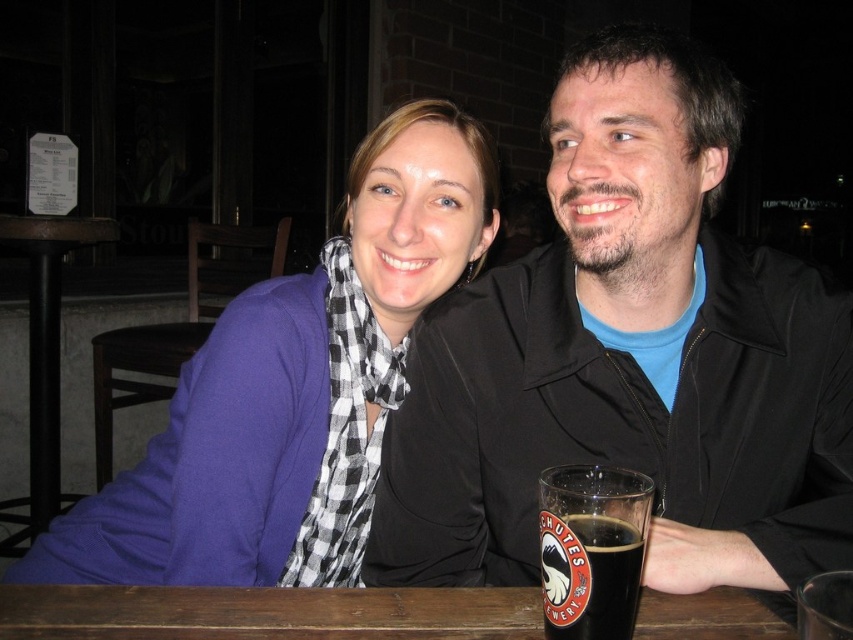
Question: Among these objects, which one is nearest to the camera?

Choices:
 (A) brown wooden table at lower left
 (B) black matte jacket at upper right

Answer: (B)

Question: Which point is farther from the camera taking this photo?

Choices:
 (A) (474, 205)
 (B) (30, 486)
 (C) (573, 621)

Answer: (B)

Question: Can you confirm if black matte jacket at upper right is thinner than brown wooden table at lower center?

Choices:
 (A) yes
 (B) no

Answer: (A)

Question: Can you confirm if purple soft fabric scarf at upper left is smaller than brown wooden table at lower left?

Choices:
 (A) yes
 (B) no

Answer: (A)

Question: Which point appears farthest from the camera in this image?

Choices:
 (A) (57, 500)
 (B) (407, 609)
 (C) (352, 260)

Answer: (A)

Question: Is brown wooden table at lower center further to camera compared to brown wooden table at lower left?

Choices:
 (A) yes
 (B) no

Answer: (B)